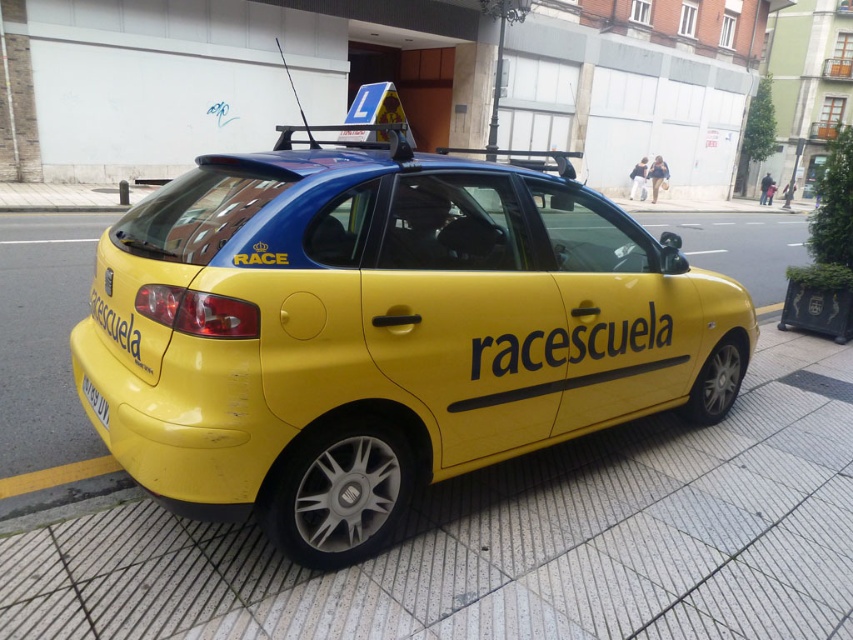
Which is more to the right, yellow concrete pavement at lower right or yellow matte text at rear?

yellow concrete pavement at lower right is more to the right.

Can you confirm if yellow concrete pavement at lower right is smaller than yellow matte text at rear?

Actually, yellow concrete pavement at lower right might be larger than yellow matte text at rear.

Which is in front, point (741, 604) or point (160, 332)?

Point (160, 332)

In order to click on yellow concrete pavement at lower right in this screenshot , I will do `click(506, 541)`.

Between yellow matte car at center and yellow plastic license plate at lower left, which one has less height?

yellow plastic license plate at lower left

Between point (177, 504) and point (105, 412), which one is positioned behind?

Positioned behind is point (105, 412).

Image resolution: width=853 pixels, height=640 pixels. In order to click on yellow matte car at center in this screenshot , I will do `click(380, 330)`.

Which is more to the right, yellow matte text at center or yellow matte text at rear?

yellow matte text at center

Based on the photo, who is more forward, (477,346) or (148,330)?

Point (148,330) is more forward.

Between point (556, 340) and point (114, 353), which one is positioned in front?

Point (114, 353) is in front.

Identify the location of yellow matte text at center. (606, 336).